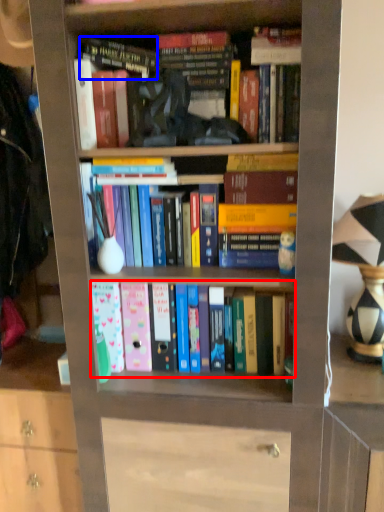
Question: Which point is closer to the camera, book (highlighted by a red box) or book (highlighted by a blue box)?

Choices:
 (A) book
 (B) book

Answer: (B)